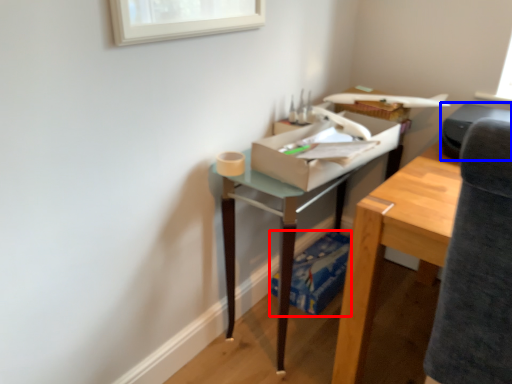
Question: Which point is closer to the camera, cardboard box (highlighted by a red box) or printer (highlighted by a blue box)?

Choices:
 (A) cardboard box
 (B) printer

Answer: (B)